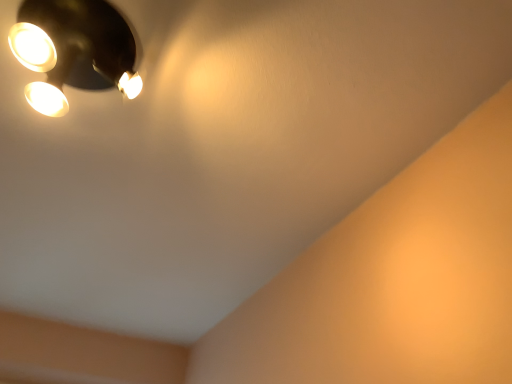
Describe the element at coordinates (74, 50) in the screenshot. I see `matte black lamp at upper left` at that location.

Image resolution: width=512 pixels, height=384 pixels. What are the coordinates of `matte black lamp at upper left` in the screenshot? It's located at (74, 50).

This screenshot has height=384, width=512. In order to click on matte black lamp at upper left in this screenshot , I will do `click(74, 50)`.